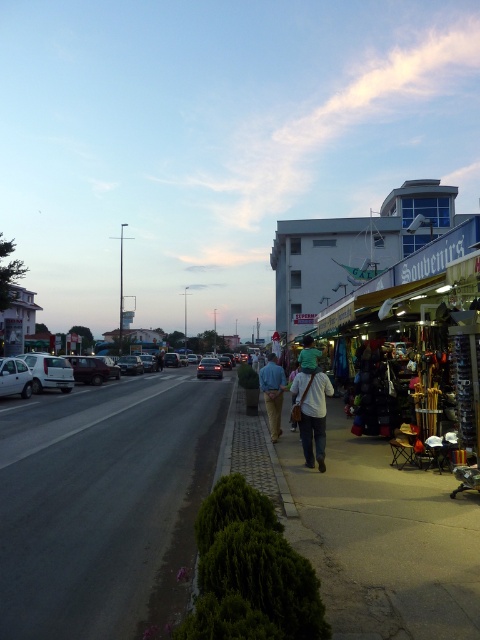
Does white cotton shirt at center have a smaller size compared to white matte car at left?

Yes.

Is point (302, 371) positioned behind point (24, 387)?

No, it is in front of (24, 387).

Is point (305, 392) closer to camera compared to point (17, 372)?

Yes, point (305, 392) is closer to viewer.

Identify the location of white cotton shirt at center. Image resolution: width=480 pixels, height=640 pixels. (312, 412).

In the scene shown: Who is lower down, white cotton shirt at center or dark gray metallic car at center?

dark gray metallic car at center

Between point (324, 420) and point (216, 362), which one is positioned in front?

Point (324, 420) is in front.

You are a GUI agent. You are given a task and a screenshot of the screen. Output one action in this format:
    pyautogui.click(x=<x>, y=<y>)
    Task: Click on the white cotton shirt at center
    The image size is (480, 640).
    Given the screenshot: What is the action you would take?
    point(312,412)

Which is below, white cotton shirt at center or matte black car at center?

matte black car at center is lower down.

Does white cotton shirt at center have a larger size compared to matte black car at center?

Actually, white cotton shirt at center might be smaller than matte black car at center.

Image resolution: width=480 pixels, height=640 pixels. In order to click on white cotton shirt at center in this screenshot , I will do `click(312, 412)`.